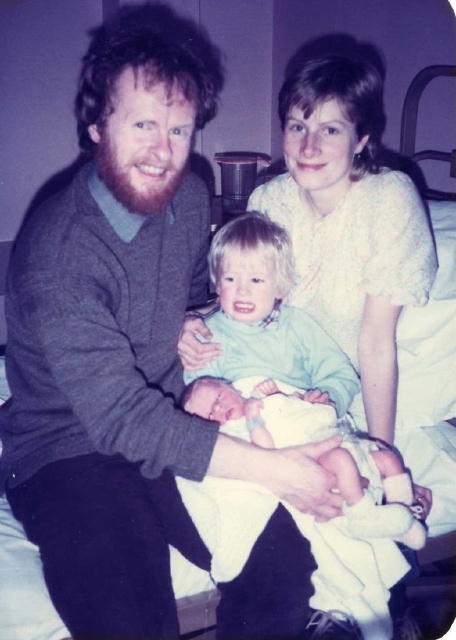
Question: Is light green fabric baby at center thinner than white clothed baby at center?

Choices:
 (A) yes
 (B) no

Answer: (A)

Question: Is light green fabric baby at center to the right of white clothed baby at center from the viewer's perspective?

Choices:
 (A) yes
 (B) no

Answer: (B)

Question: Considering the real-world distances, which object is farthest from the light green fabric baby at center?

Choices:
 (A) white dotted blouse at upper center
 (B) white clothed baby at center

Answer: (A)

Question: Which of these objects is positioned closest to the light green fabric baby at center?

Choices:
 (A) white clothed baby at center
 (B) white dotted blouse at upper center

Answer: (A)

Question: Which of the following is the farthest from the observer?

Choices:
 (A) (424, 534)
 (B) (300, 246)

Answer: (B)

Question: Does white dotted blouse at upper center have a greater width compared to white clothed baby at center?

Choices:
 (A) no
 (B) yes

Answer: (A)